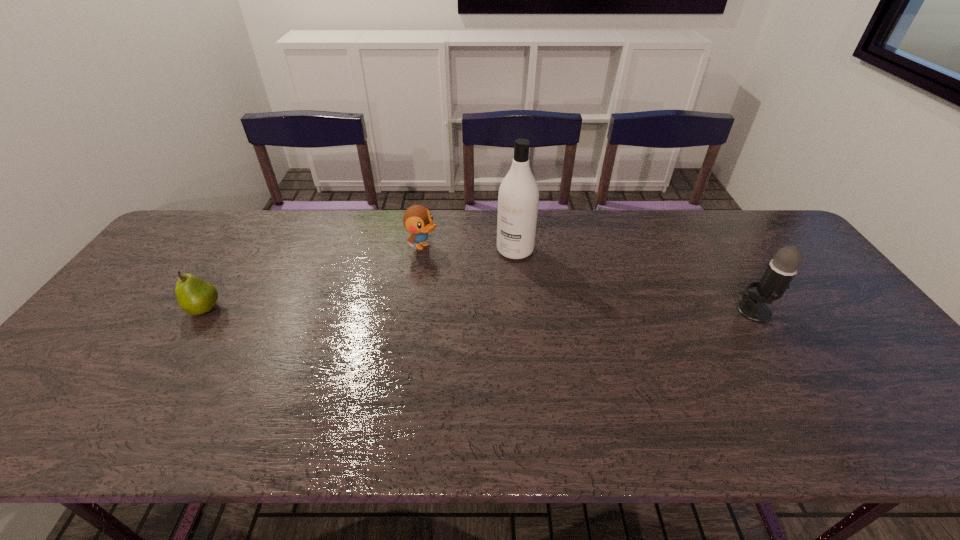
At what (x,y) coordinates should I click in order to perform the action: click on free space on the desktop that is between the leftmost object and the third shortest object and is positioned on the front-facing side of the second object from left to right. Please return your answer as a coordinate pair (x, y). Looking at the image, I should click on (553, 310).

At what (x,y) coordinates should I click in order to perform the action: click on vacant space on the desktop that is between the leftmost object and the second tallest object and is positioned on the front-facing side of the tallest object. Please return your answer as a coordinate pair (x, y). This screenshot has height=540, width=960. Looking at the image, I should click on (467, 310).